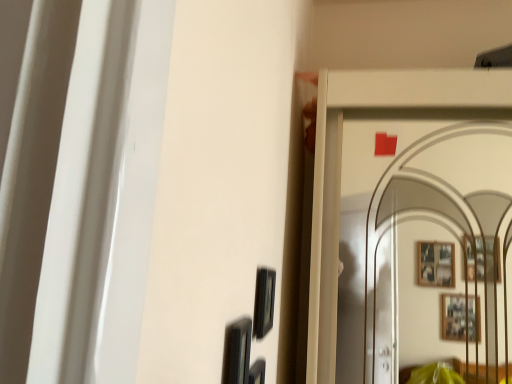
Question: From the image's perspective, relative to black glossy picture frame at lower center, acting as the 1th picture frame starting from the front, is matte black picture frame at center, positioned as the 1th picture frame in back-to-front order, above or below?

Choices:
 (A) below
 (B) above

Answer: (B)

Question: Is matte black picture frame at center, the second picture frame in the front-to-back sequence, taller or shorter than black glossy picture frame at lower center, the second picture frame positioned from the back?

Choices:
 (A) tall
 (B) short

Answer: (B)

Question: In terms of size, does matte black picture frame at center, the second picture frame in the front-to-back sequence, appear bigger or smaller than black glossy picture frame at lower center, the second picture frame positioned from the back?

Choices:
 (A) small
 (B) big

Answer: (A)

Question: In terms of height, does black glossy picture frame at lower center, the second picture frame positioned from the back, look taller or shorter compared to matte black picture frame at center, positioned as the 1th picture frame in back-to-front order?

Choices:
 (A) short
 (B) tall

Answer: (B)

Question: Is black glossy picture frame at lower center, the second picture frame positioned from the back, inside or outside of matte black picture frame at center, positioned as the 1th picture frame in back-to-front order?

Choices:
 (A) inside
 (B) outside

Answer: (B)

Question: Visually, is black glossy picture frame at lower center, the second picture frame positioned from the back, positioned to the left or to the right of matte black picture frame at center, positioned as the 1th picture frame in back-to-front order?

Choices:
 (A) left
 (B) right

Answer: (A)

Question: Looking at their shapes, would you say black glossy picture frame at lower center, acting as the 1th picture frame starting from the front, is wider or thinner than matte black picture frame at center, positioned as the 1th picture frame in back-to-front order?

Choices:
 (A) thin
 (B) wide

Answer: (B)